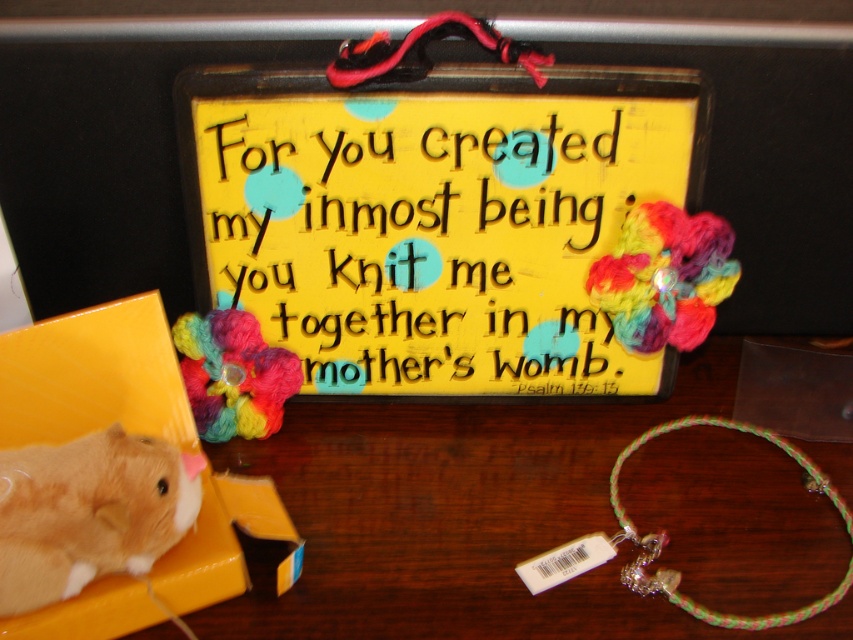
Question: Is multicolored yarn flower at upper right to the right of multicolored braided bracelet at lower right from the viewer's perspective?

Choices:
 (A) yes
 (B) no

Answer: (B)

Question: Is yellow wood sign at center positioned in front of multicolored yarn flower at left?

Choices:
 (A) no
 (B) yes

Answer: (B)

Question: Which object is the closest to the multicolored yarn flower at left?

Choices:
 (A) multicolored yarn flower at upper right
 (B) yellow wood sign at center
 (C) multicolored braided bracelet at lower right

Answer: (B)

Question: Estimate the real-world distances between objects in this image. Which object is closer to the fluffy orange mouse at lower left?

Choices:
 (A) multicolored yarn flower at left
 (B) multicolored braided bracelet at lower right

Answer: (A)

Question: Which of these objects is positioned farthest from the fluffy orange mouse at lower left?

Choices:
 (A) multicolored yarn flower at left
 (B) multicolored braided bracelet at lower right

Answer: (B)

Question: Can you confirm if multicolored yarn flower at left is positioned above multicolored braided bracelet at lower right?

Choices:
 (A) no
 (B) yes

Answer: (B)